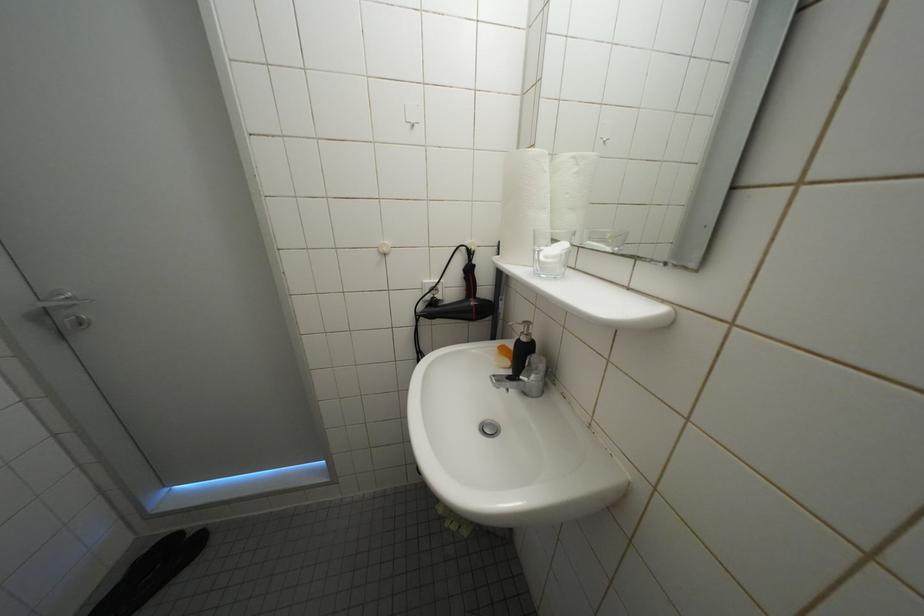
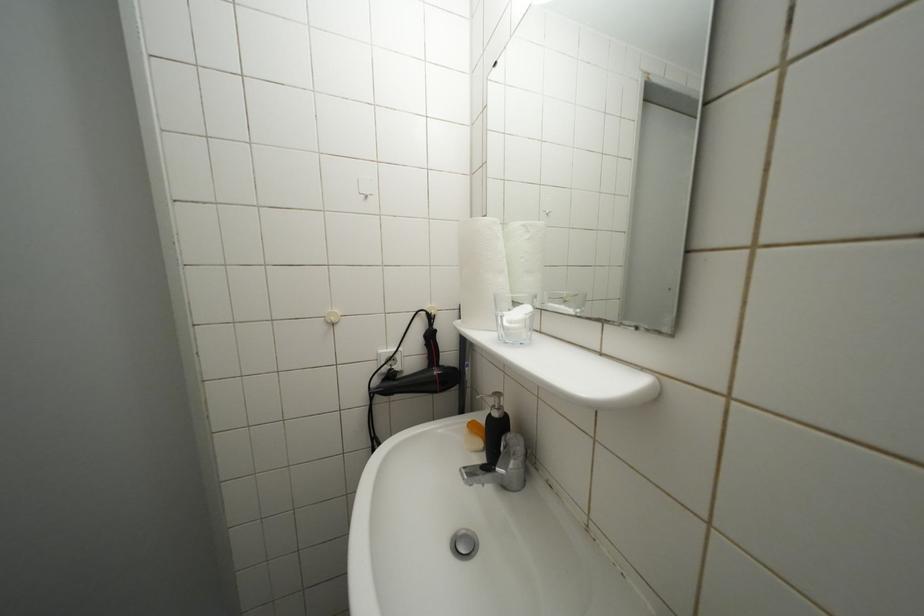
Question: Which direction would the cameraman need to move to produce the second image? Reply with the corresponding letter.

Choices:
 (A) Left
 (B) Right
 (C) Forward
 (D) Backward

Answer: (C)